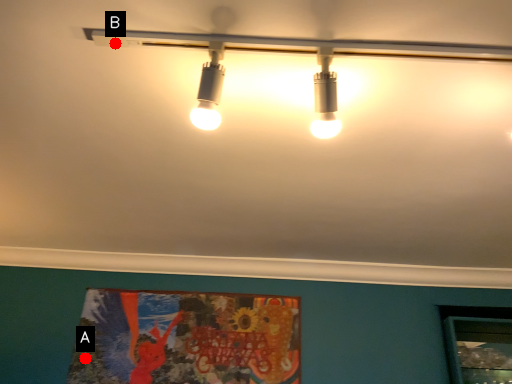
Question: Two points are circled on the image, labeled by A and B beside each circle. Which point is further to the camera?

Choices:
 (A) A is further
 (B) B is further

Answer: (A)